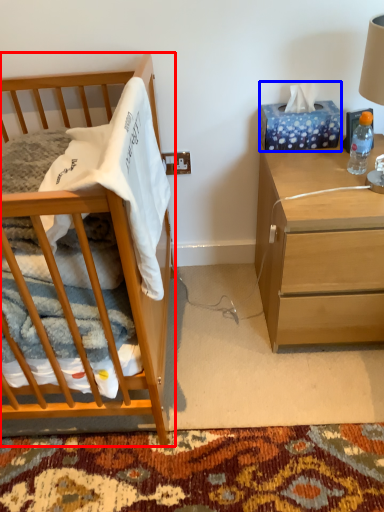
Question: Among these objects, which one is farthest to the camera, cabinetry (highlighted by a red box) or tissue paper (highlighted by a blue box)?

Choices:
 (A) cabinetry
 (B) tissue paper

Answer: (B)